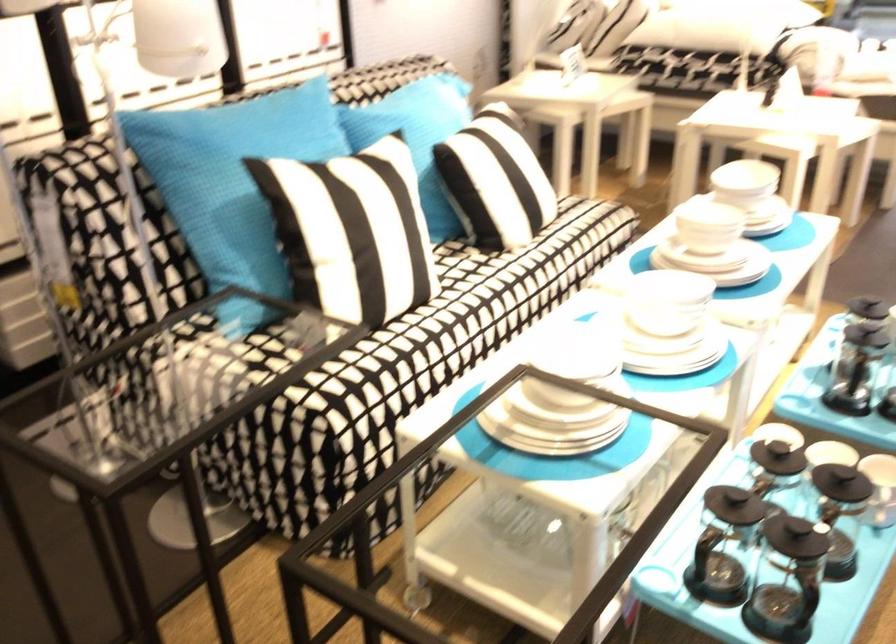
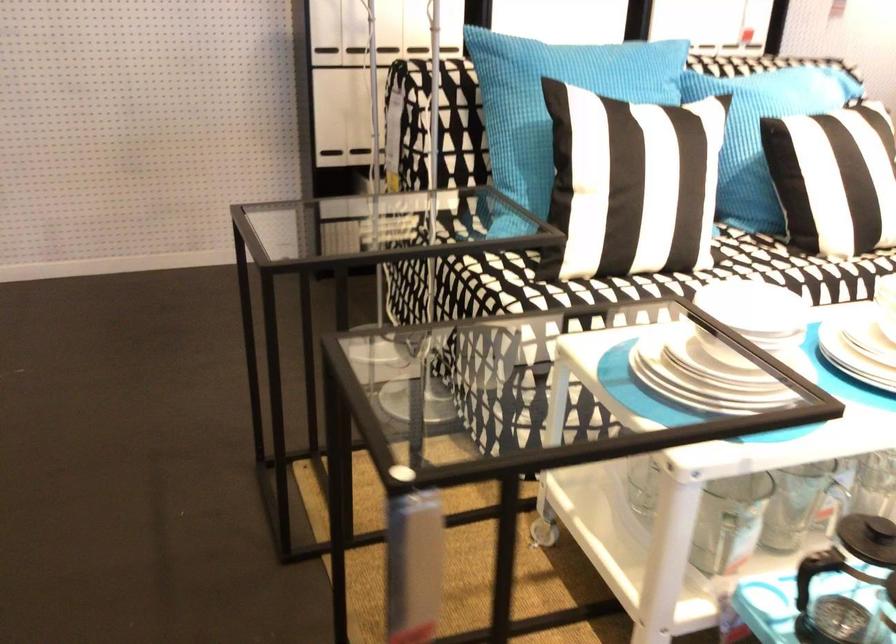
The point at (728, 500) is marked in the first image. Where is the corresponding point in the second image?

(867, 538)